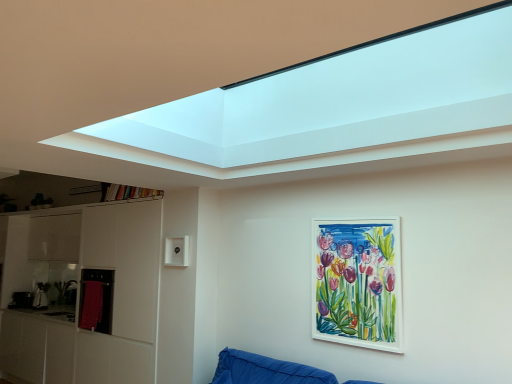
You are a GUI agent. You are given a task and a screenshot of the screen. Output one action in this format:
    pyautogui.click(x=<x>, y=<y>)
    Task: Click on the free space above white matte picture frame at center-right (from a real-world perspective)
    
    Given the screenshot: What is the action you would take?
    pyautogui.click(x=352, y=214)